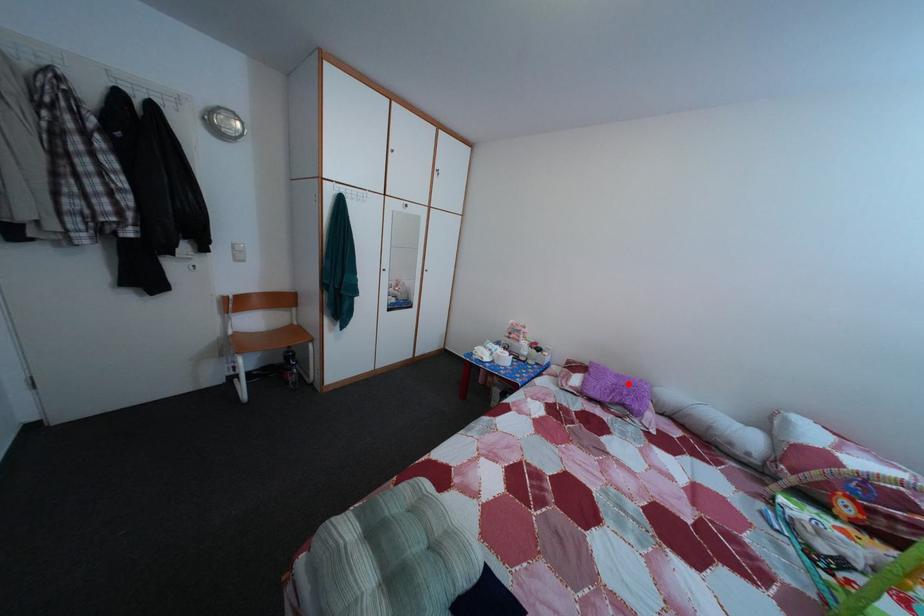
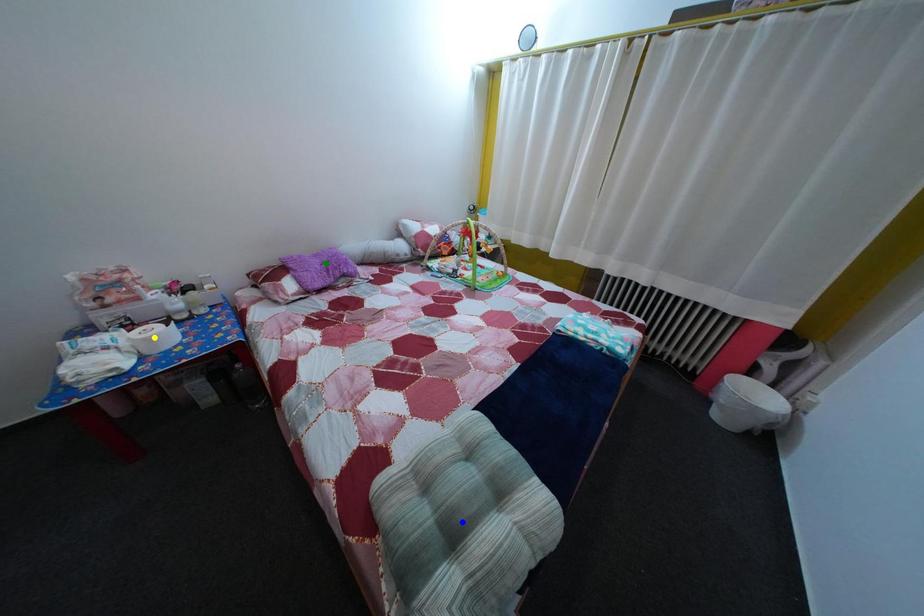
Question: I am providing you with two images of the same scene from different viewpoints. A red point is marked on the first image. You are given multiple points on the second image. Can you choose the point in image 2 that corresponds to the point in image 1?

Choices:
 (A) yellow point
 (B) green point
 (C) blue point

Answer: (B)